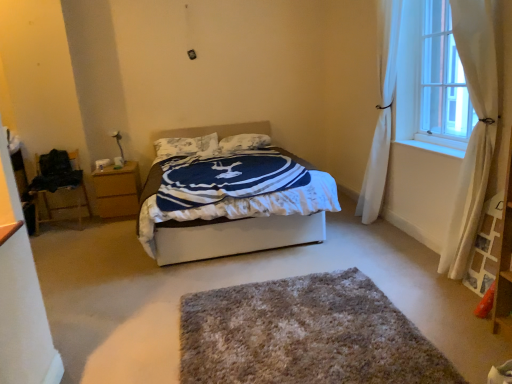
You are a GUI agent. You are given a task and a screenshot of the screen. Output one action in this format:
    pyautogui.click(x=<x>, y=<y>)
    Task: Click on the free location in front of wooden chair at left
    The height and width of the screenshot is (384, 512).
    Given the screenshot: What is the action you would take?
    pyautogui.click(x=60, y=239)